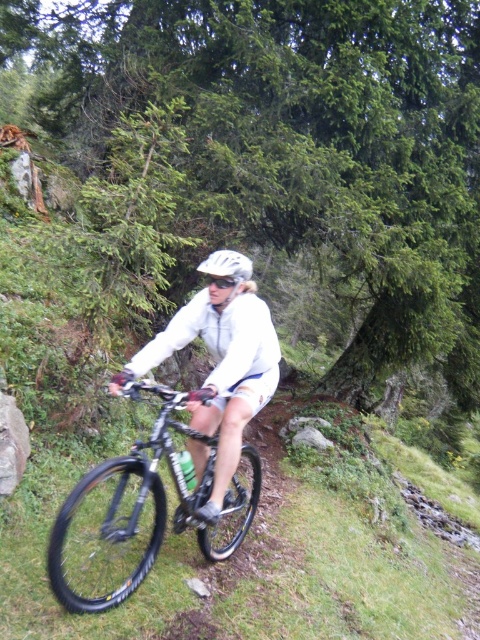
Question: Which object is farther from the camera taking this photo?

Choices:
 (A) transparent plastic goggles at center
 (B) white matte bicycle helmet at center
 (C) shiny metallic bicycle at center

Answer: (A)

Question: Can you confirm if white matte bicycle helmet at center is positioned to the left of transparent plastic goggles at center?

Choices:
 (A) no
 (B) yes

Answer: (A)

Question: Which object appears closest to the camera in this image?

Choices:
 (A) transparent plastic goggles at center
 (B) shiny metallic bicycle at center
 (C) white matte bicycle helmet at center

Answer: (B)

Question: Is shiny metallic bicycle at center to the left of transparent plastic goggles at center from the viewer's perspective?

Choices:
 (A) yes
 (B) no

Answer: (A)

Question: Is shiny metallic bicycle at center thinner than transparent plastic goggles at center?

Choices:
 (A) no
 (B) yes

Answer: (A)

Question: Which object is closer to the camera taking this photo?

Choices:
 (A) transparent plastic goggles at center
 (B) white matte bicycle helmet at center

Answer: (B)